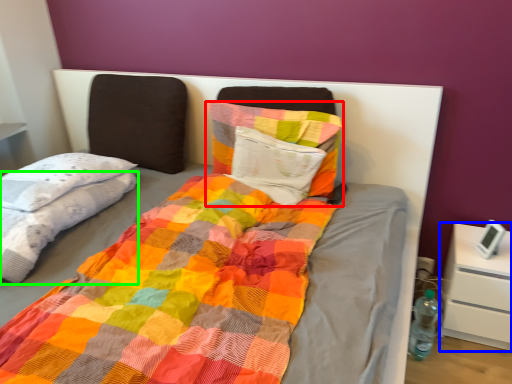
Question: Based on their relative distances, which object is nearer to pillow (highlighted by a red box)? Choose from nightstand (highlighted by a blue box) and blanket (highlighted by a green box).

Choices:
 (A) nightstand
 (B) blanket

Answer: (B)